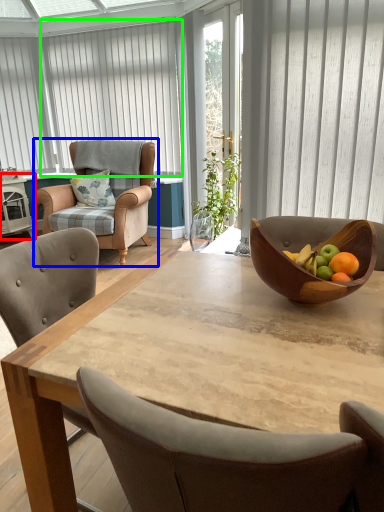
Question: Which object is positioned closest to side table (highlighted by a red box)? Select from chair (highlighted by a blue box) and curtain (highlighted by a green box).

Choices:
 (A) chair
 (B) curtain

Answer: (A)